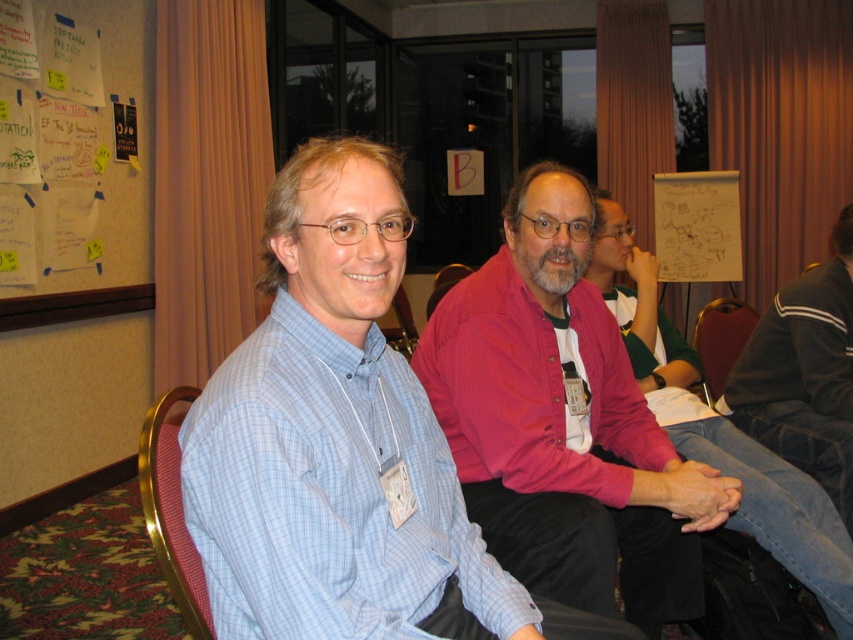
Question: Which point is farther to the camera?

Choices:
 (A) white paper at upper left
 (B) dark gray sweater at right
 (C) white paper at upper center
 (D) light blue checkered shirt at left

Answer: (C)

Question: Does white paper at upper left come behind brown leather chair at center?

Choices:
 (A) no
 (B) yes

Answer: (B)

Question: Can you confirm if wooden at center is positioned below matte plastic chair at center?

Choices:
 (A) yes
 (B) no

Answer: (B)

Question: From the image, what is the correct spatial relationship of white paper at upper center in relation to matte plastic chair at center?

Choices:
 (A) right
 (B) left

Answer: (A)

Question: Among these points, which one is nearest to the camera?

Choices:
 (A) (764, 396)
 (B) (672, 182)

Answer: (A)

Question: Which is nearer to the white paper at upper left?

Choices:
 (A) matte plastic chair at center
 (B) red fabric chair at lower left
 (C) wooden at center
 (D) brown leather chair at center

Answer: (A)